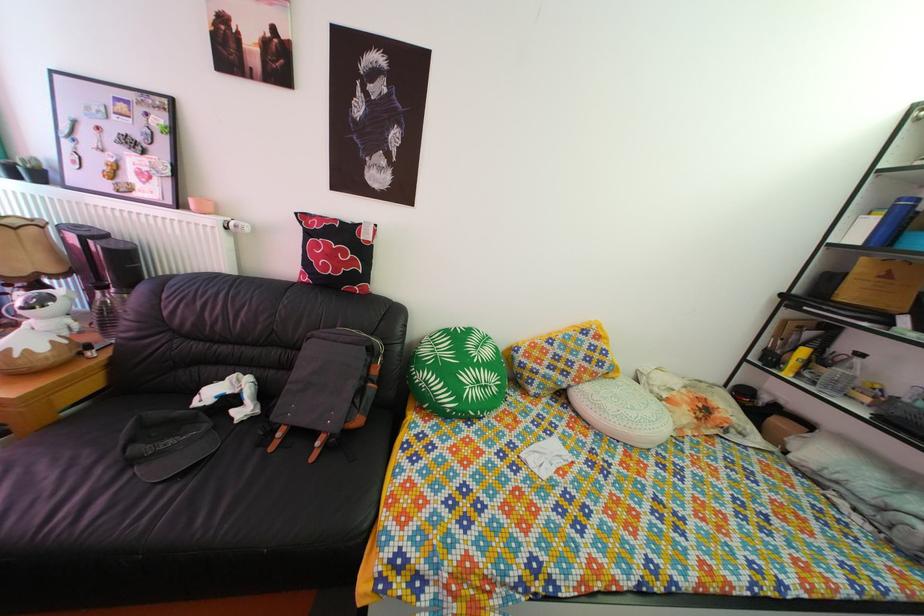
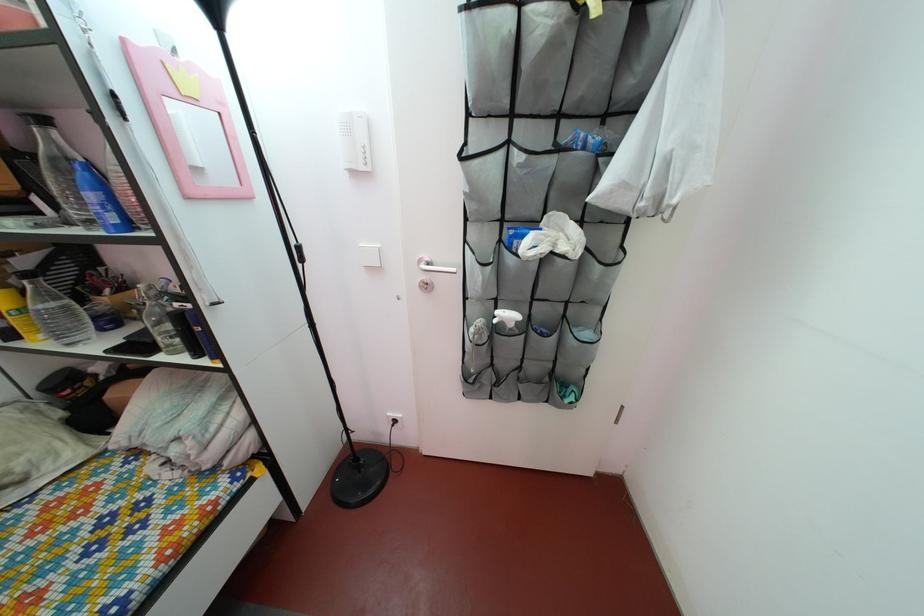
In the second image, find the point that corresponds to point (803, 373) in the first image.

(27, 330)